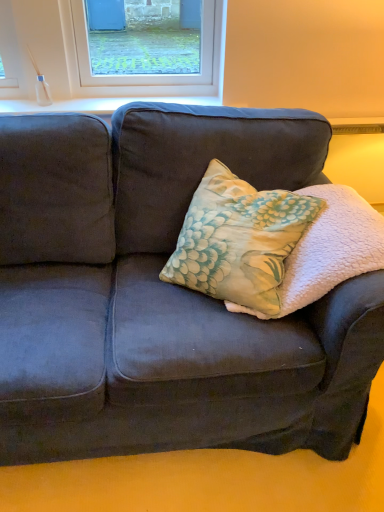
Locate an element on the screen. free space above white smooth window sill at upper center (from a real-world perspective) is located at coordinates (134, 100).